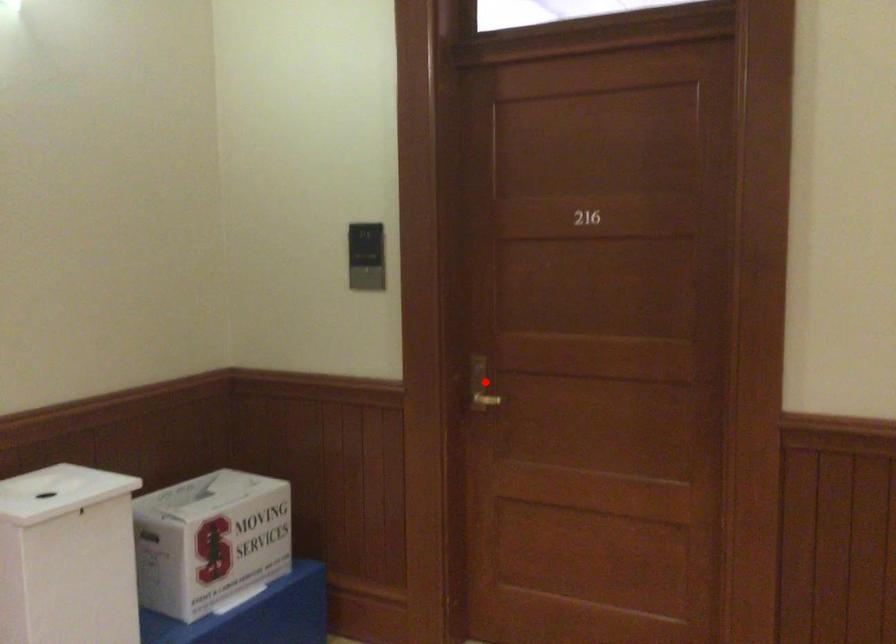
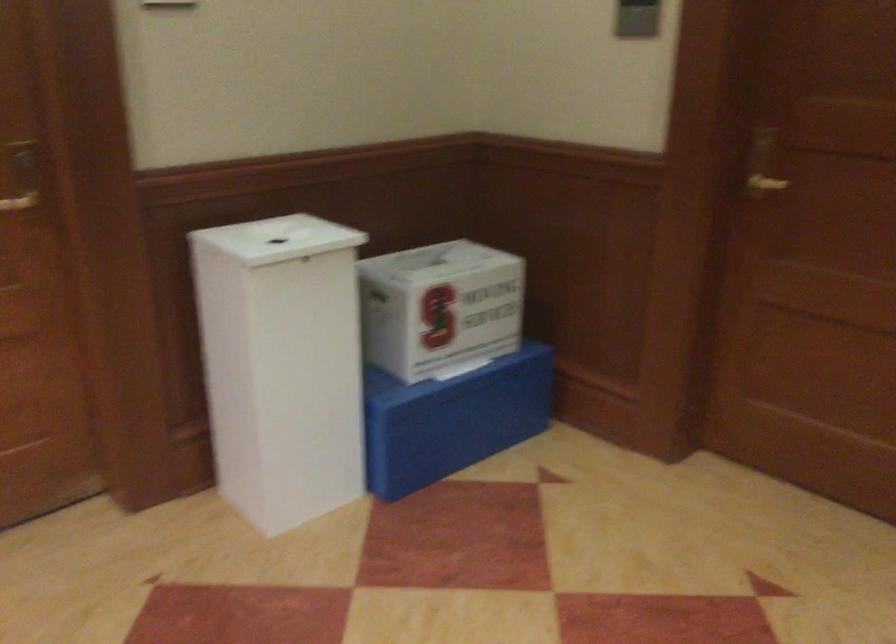
Question: I am providing you with two images of the same scene from different viewpoints. A red point is marked on the first image. Is the red point's position out of view in image 2?

Choices:
 (A) Yes
 (B) No

Answer: (B)